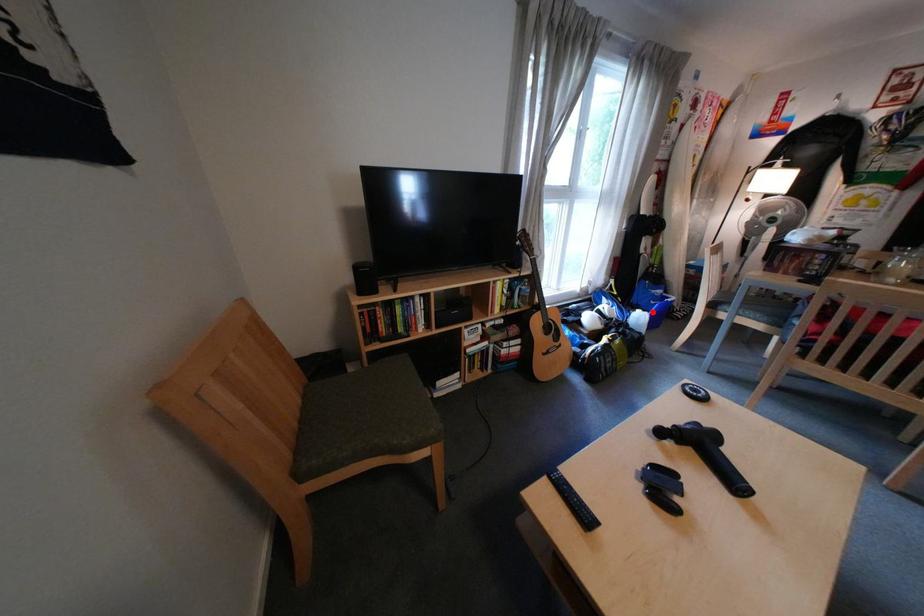
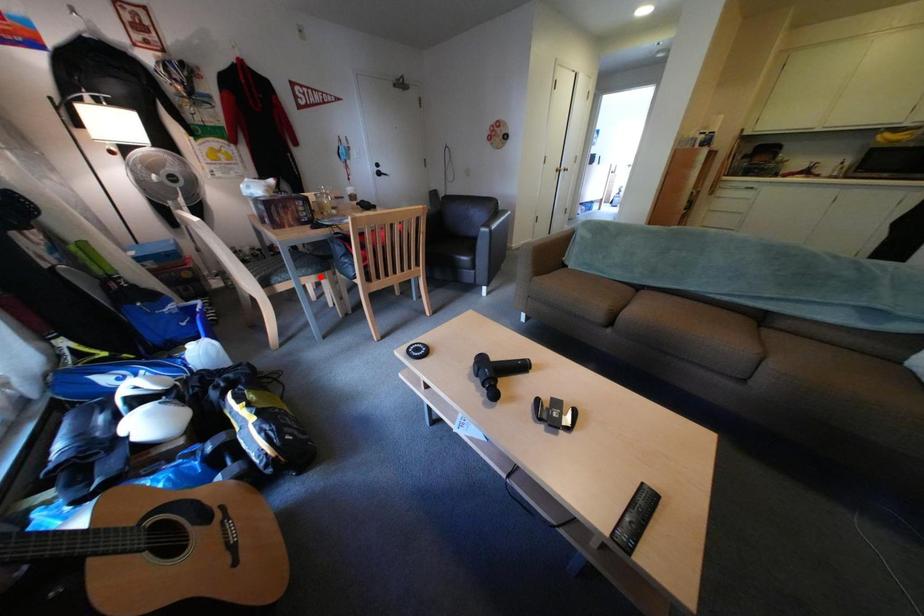
I am providing you with two images of the same scene from different viewpoints. A red point is marked on the first image and another point is marked on the second image. Are the points marked in image1 and image2 representing the same 3D position?

No